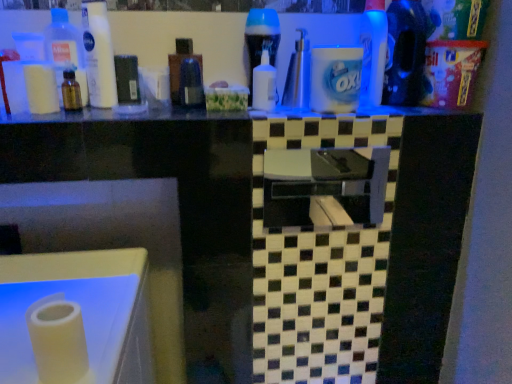
Image resolution: width=512 pixels, height=384 pixels. Find the location of `free space in front of blue glossy bottle at upper right, which ranks as the third cleaning product in left-to-right order`. free space in front of blue glossy bottle at upper right, which ranks as the third cleaning product in left-to-right order is located at coordinates (398, 109).